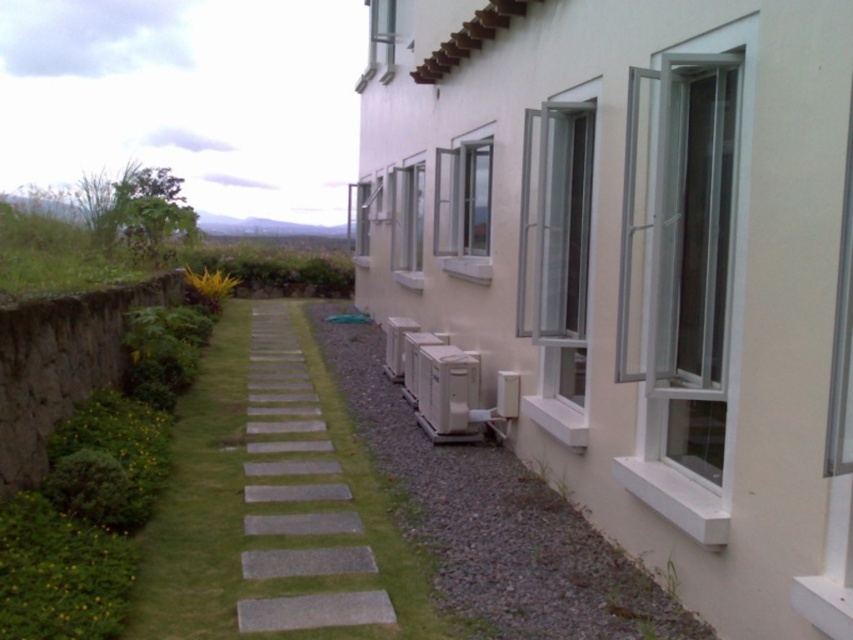
Question: Where is green grass at lower left located in relation to gray concrete path at center in the image?

Choices:
 (A) above
 (B) below

Answer: (B)

Question: Is green grass at lower left smaller than gray concrete path at center?

Choices:
 (A) no
 (B) yes

Answer: (B)

Question: Among these points, which one is nearest to the camera?

Choices:
 (A) [303, 516]
 (B) [318, 436]

Answer: (A)

Question: Can you confirm if green grass at lower left is thinner than gray concrete path at center?

Choices:
 (A) no
 (B) yes

Answer: (B)

Question: Which point is farther to the camera?

Choices:
 (A) (184, 440)
 (B) (264, 524)

Answer: (A)